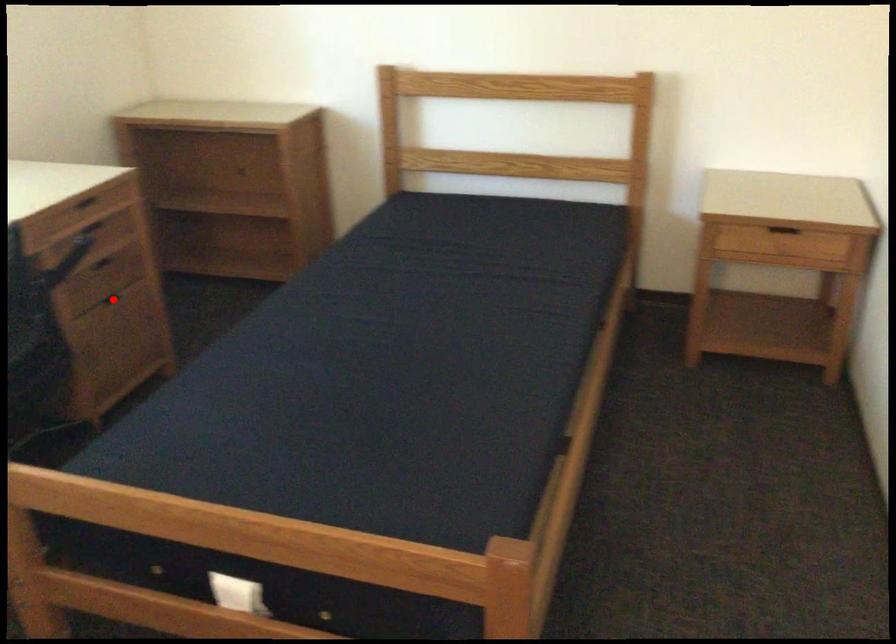
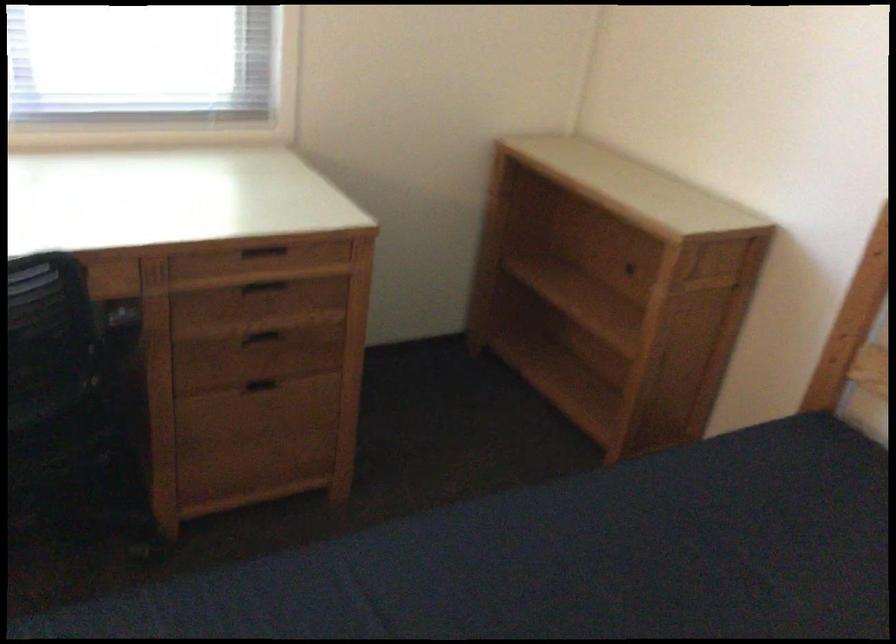
Locate, in the second image, the point that corresponds to the highlighted location in the first image.

(261, 384)